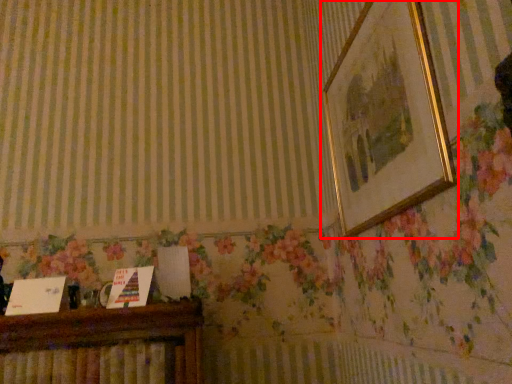
Question: Considering the relative positions of picture frame (annotated by the red box) and furniture in the image provided, where is picture frame (annotated by the red box) located with respect to the staircase?

Choices:
 (A) left
 (B) right

Answer: (B)